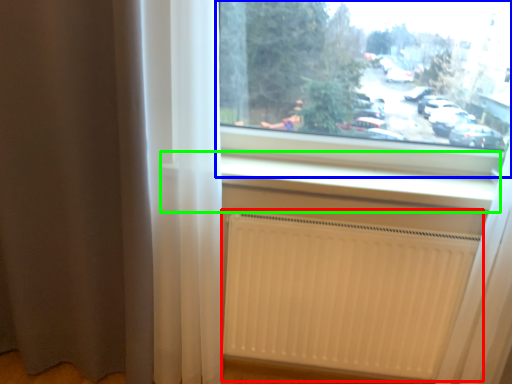
Question: Considering the real-world distances, which object is closest to radiator (highlighted by a red box)? window (highlighted by a blue box) or window sill (highlighted by a green box).

Choices:
 (A) window
 (B) window sill

Answer: (B)